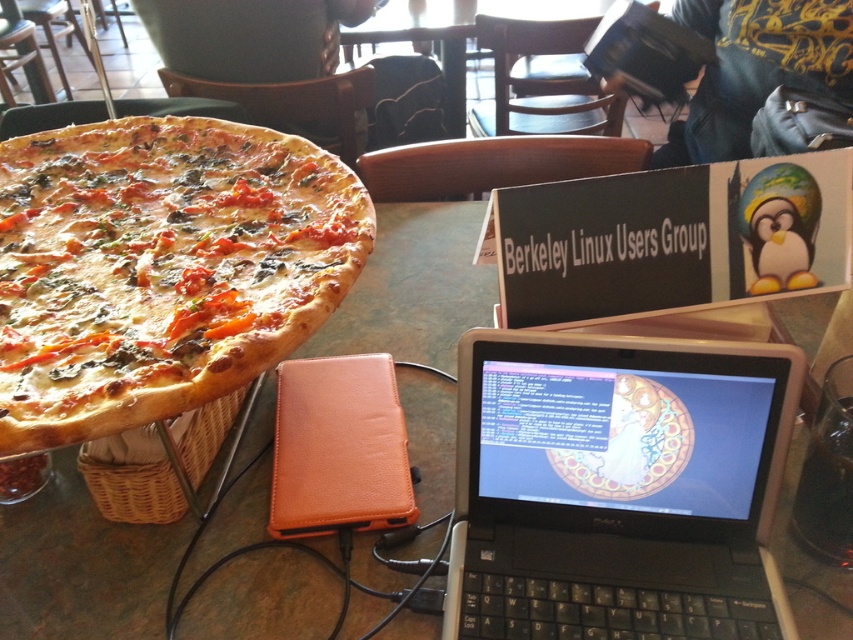
You are a delivery robot with a 12 inch wide tray. You need to place an order on the table between the black plastic laptop at center and the golden brown crusty pizza at left. Can your tray fit in the space between them?

The distance between the black plastic laptop at center and the golden brown crusty pizza at left is 13.35 inches. Since the tray is 12 inches wide, it can fit within the available space.

You are sitting at the table in the image and want to grab the black plastic laptop at center without moving your chair. Can you reach it if your arm can extend 25 inches?

The black plastic laptop at center is 24.61 inches away from the viewer, so yes, you can reach it with your arm extended to 25 inches.